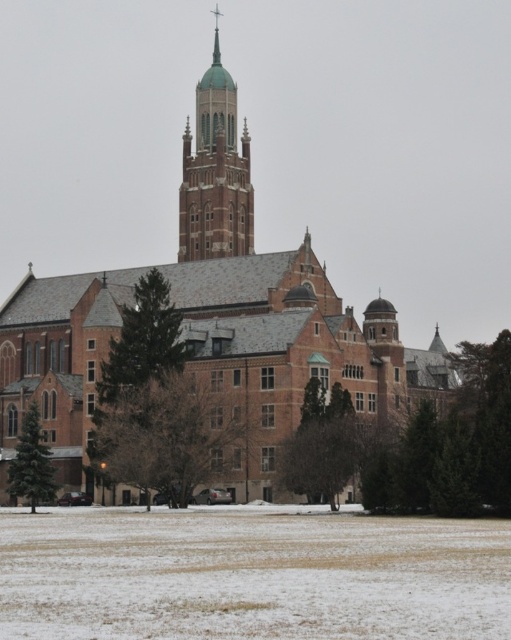
Based on the scene description, what is the significance of the point marked at coordinates (216, 172)?

The point at coordinates (216, 172) marks the green copper dome atop the central tower of the historic building, indicating its central architectural feature and religious significance.

You are standing at the entrance of the brick church at center. If you walk straight ahead, will you eventually reach the green copper dome on top of the tower?

Yes, walking straight ahead from the entrance of the brick church at center will lead you towards the green copper dome on top of the tower since the dome is centrally located above the main structure.